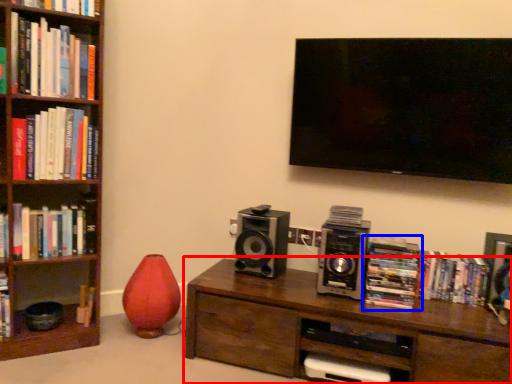
Question: Which of the following is the closest to the observer, table (highlighted by a red box) or book (highlighted by a blue box)?

Choices:
 (A) table
 (B) book

Answer: (A)